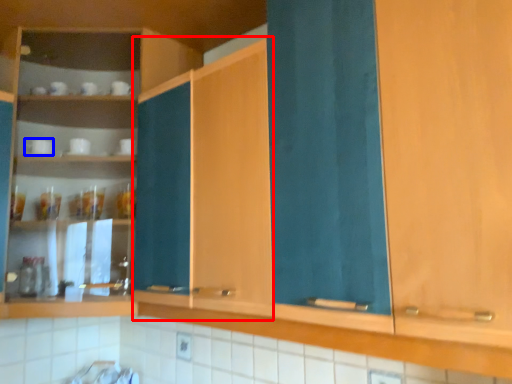
Question: Which object is further to the camera taking this photo, cabinetry (highlighted by a red box) or tableware (highlighted by a blue box)?

Choices:
 (A) cabinetry
 (B) tableware

Answer: (B)